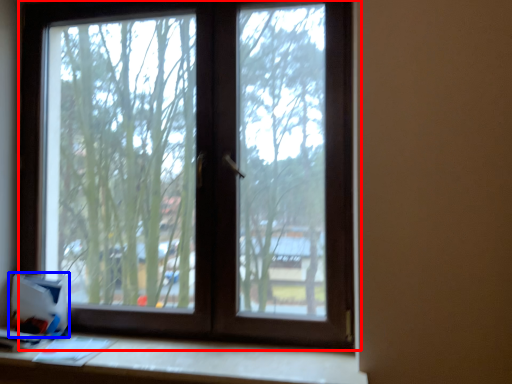
Question: Which point is further to the camera, window (highlighted by a red box) or cardboard box (highlighted by a blue box)?

Choices:
 (A) window
 (B) cardboard box

Answer: (B)